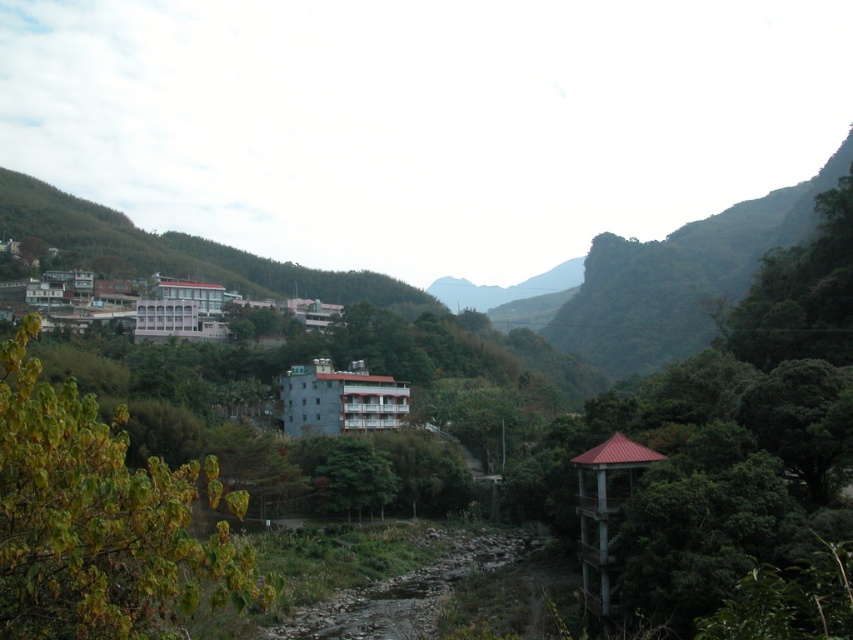
Question: Is green leafy tree at left above green leafy tree at center?

Choices:
 (A) no
 (B) yes

Answer: (B)

Question: Which point is farther to the camera?

Choices:
 (A) (392, 472)
 (B) (173, 595)

Answer: (A)

Question: Considering the relative positions of green leafy tree at left and green leafy tree at center in the image provided, where is green leafy tree at left located with respect to green leafy tree at center?

Choices:
 (A) right
 (B) left

Answer: (B)

Question: Can you confirm if green leafy tree at left is positioned to the left of green leafy tree at center?

Choices:
 (A) no
 (B) yes

Answer: (B)

Question: Among these points, which one is farthest from the camera?

Choices:
 (A) (61, 564)
 (B) (337, 472)

Answer: (B)

Question: Which point is farther to the camera?

Choices:
 (A) green leafy tree at center
 (B) green leafy tree at left

Answer: (A)